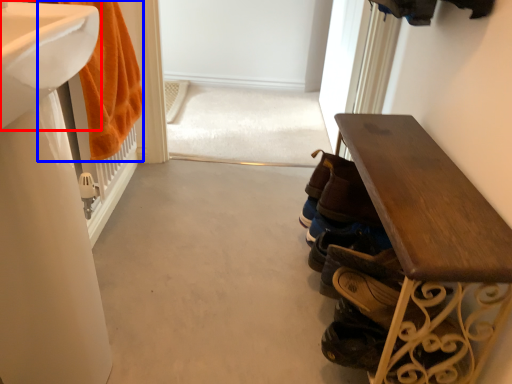
Question: Which point is closer to the camera, sink (highlighted by a red box) or bath towel (highlighted by a blue box)?

Choices:
 (A) sink
 (B) bath towel

Answer: (A)